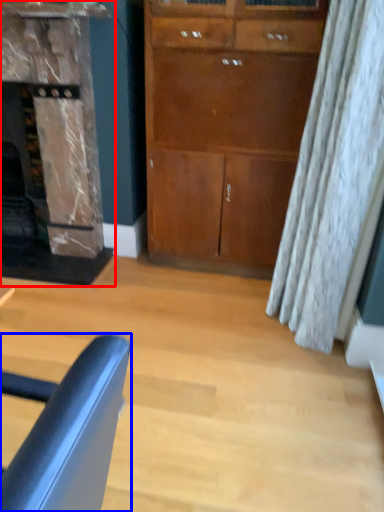
Question: Which of the following is the closest to the observer, fireplace (highlighted by a red box) or chair (highlighted by a blue box)?

Choices:
 (A) fireplace
 (B) chair

Answer: (B)